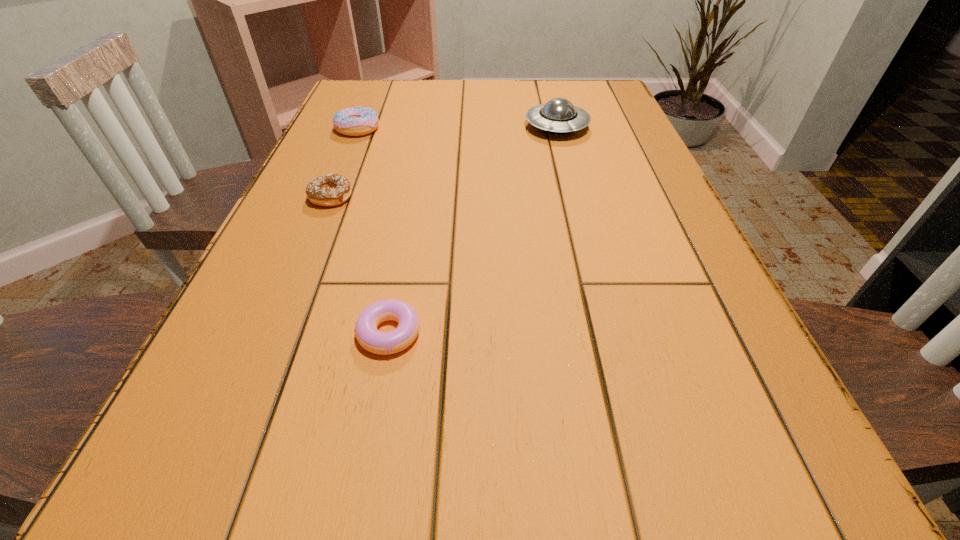
Locate an element on the screen. vacant area located on the right of the nearest doughnut is located at coordinates (645, 333).

Locate an element on the screen. The image size is (960, 540). object that is at the far edge is located at coordinates (558, 116).

Locate an element on the screen. Image resolution: width=960 pixels, height=540 pixels. object located in the right edge section of the desktop is located at coordinates (558, 116).

What are the coordinates of `object present at the far right corner` in the screenshot? It's located at (558, 116).

In order to click on free space at the far edge in this screenshot , I will do `click(508, 101)`.

Identify the location of free region at the left edge of the desktop. This screenshot has width=960, height=540. click(229, 417).

Find the location of `blank space at the right edge`. blank space at the right edge is located at coordinates (627, 282).

This screenshot has width=960, height=540. I want to click on vacant position at the far left corner of the desktop, so click(x=394, y=105).

Where is `vacant space at the far right corner of the desktop`? vacant space at the far right corner of the desktop is located at coordinates (591, 106).

The image size is (960, 540). What are the coordinates of `vacant area that lies between the saucer and the farthest doughnut` in the screenshot? It's located at (457, 128).